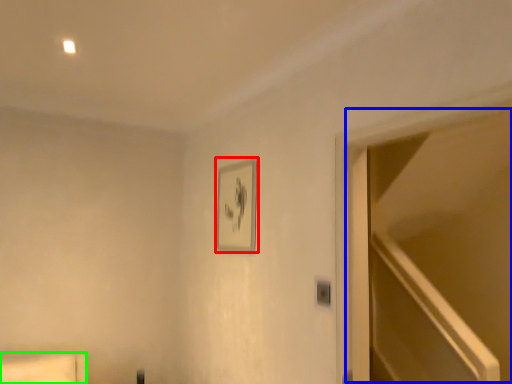
Question: Which object is the closest to the picture frame (highlighted by a red box)? Choose among these: glass door (highlighted by a blue box) or furniture (highlighted by a green box).

Choices:
 (A) glass door
 (B) furniture

Answer: (B)